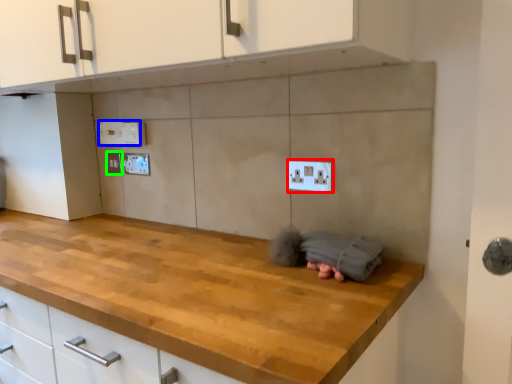
Question: Estimate the real-world distances between objects in this image. Which object is closer to electric outlet (highlighted by a red box), electric outlet (highlighted by a blue box) or electric outlet (highlighted by a green box)?

Choices:
 (A) electric outlet
 (B) electric outlet

Answer: (A)